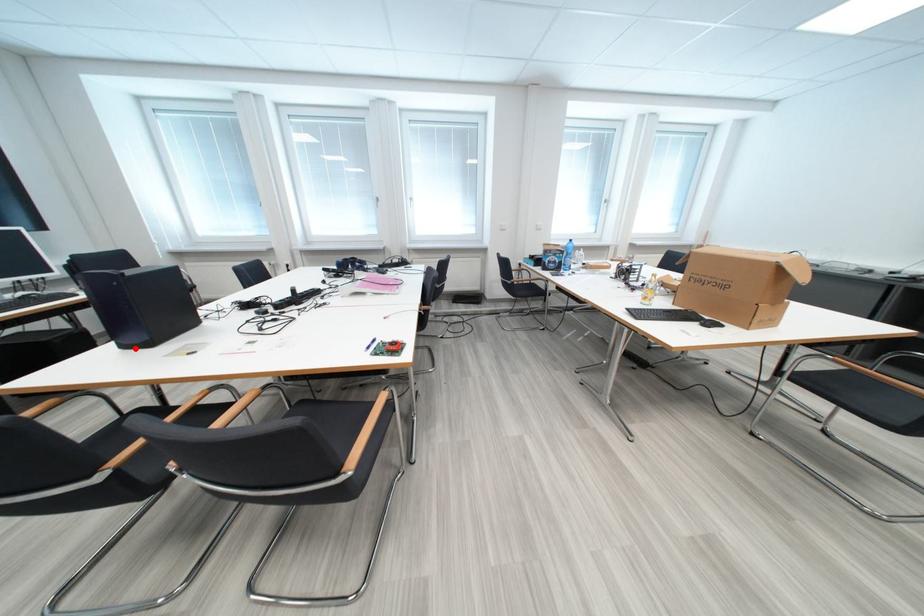
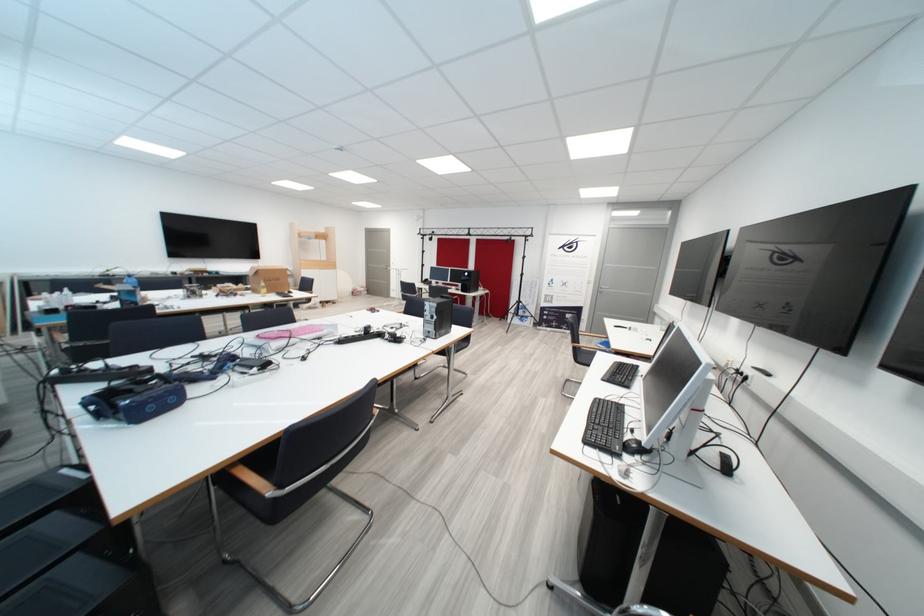
Question: I am providing you with two images of the same scene from different viewpoints. A red point is marked on the first image. At the location where the point appears in image 1, is it still visible in image 2?

Choices:
 (A) Yes
 (B) No

Answer: (B)